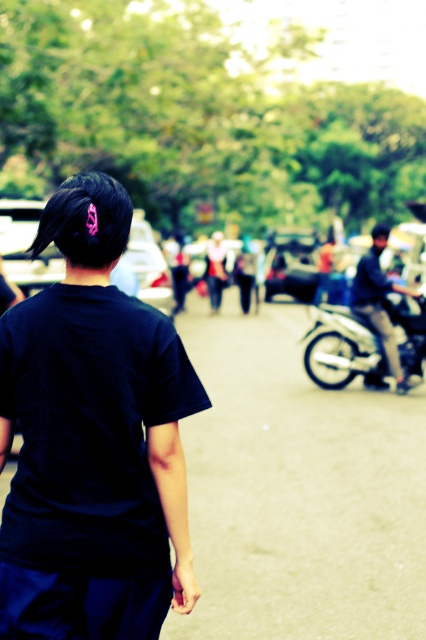
Question: Among these objects, which one is farthest from the camera?

Choices:
 (A) matte white shirt at center
 (B) black matte shirt at center

Answer: (A)

Question: Is metallic silver motorcycle at right above matte white shirt at center?

Choices:
 (A) yes
 (B) no

Answer: (B)

Question: Can you confirm if black matte shirt at center is positioned above pink plastic hair clip at upper left?

Choices:
 (A) no
 (B) yes

Answer: (A)

Question: Estimate the real-world distances between objects in this image. Which object is farther from the dark blue jeans at center?

Choices:
 (A) metallic silver motorcycle at right
 (B) pink plastic hair clip at upper left

Answer: (B)

Question: Which of the following is the farthest from the observer?

Choices:
 (A) (385, 355)
 (B) (158, 528)
 (C) (408, 310)

Answer: (C)

Question: Can you confirm if pink plastic hair clip at upper left is positioned below dark blue jeans at center?

Choices:
 (A) yes
 (B) no

Answer: (B)